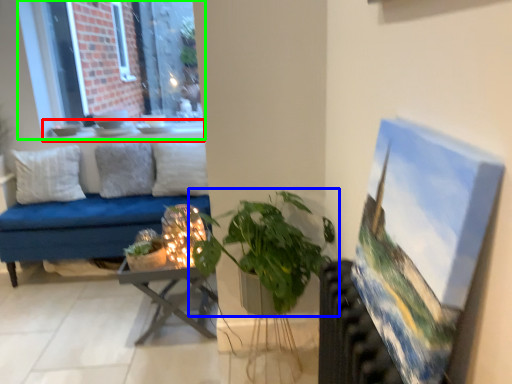
Question: Estimate the real-world distances between objects in this image. Which object is closer to window sill (highlighted by a red box), houseplant (highlighted by a blue box) or window (highlighted by a green box)?

Choices:
 (A) houseplant
 (B) window

Answer: (B)